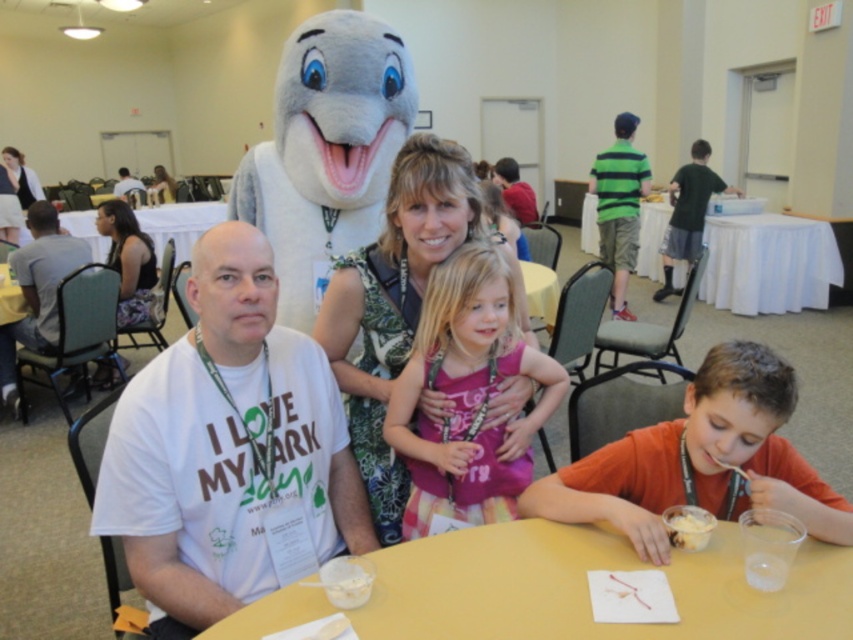
You are standing in the hall and want to move from point A to point B. Point A is at coordinate point point (x=392, y=596) and point B is at coordinate point (x=477, y=253). Which point is closer to you when you start at point A?

Point A is closer to you than point B because the description states that point (x=392, y=596) is closer to the viewer than point (x=477, y=253). Since you start at point A, it is already your current position and thus closer by default.